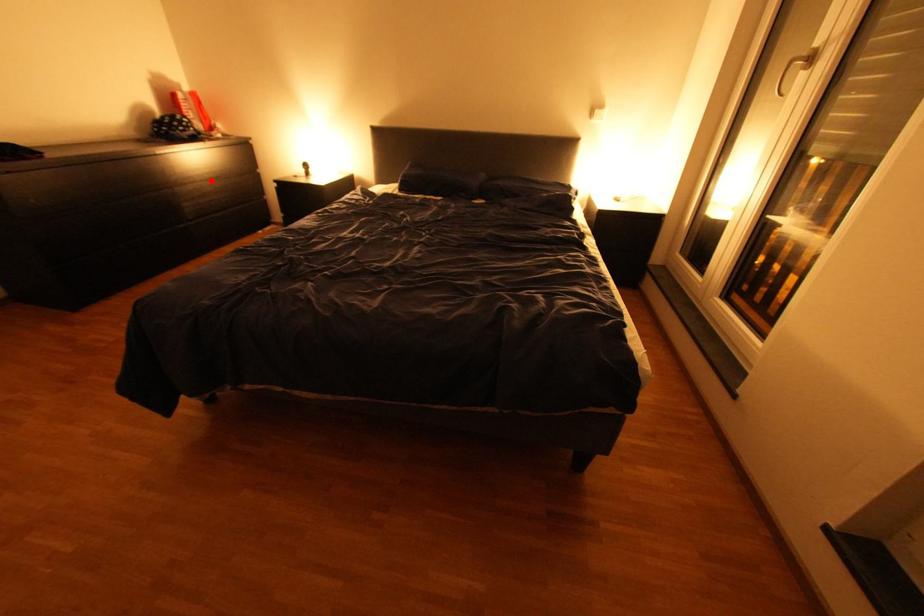
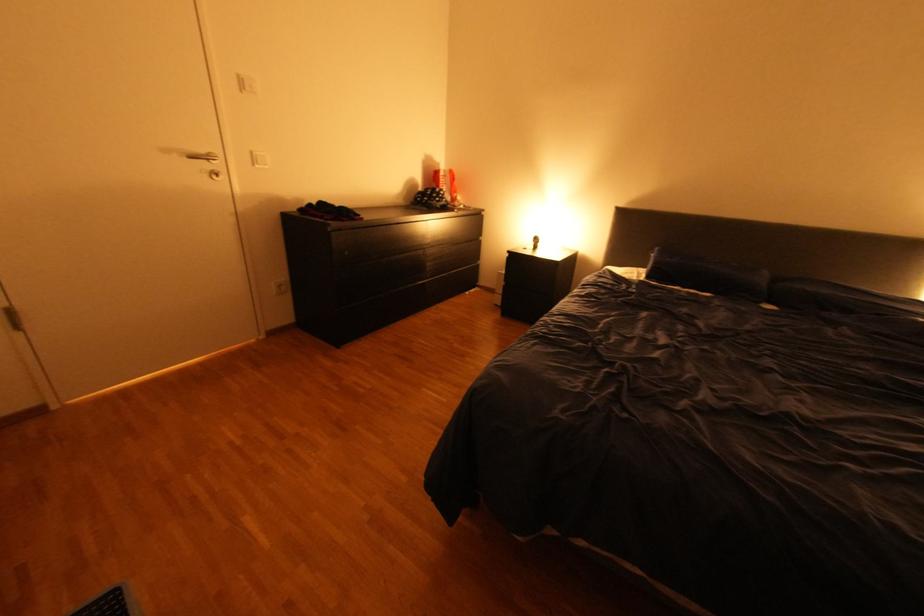
Where in the second image is the point corresponding to the highlighted location from the first image?

(454, 244)